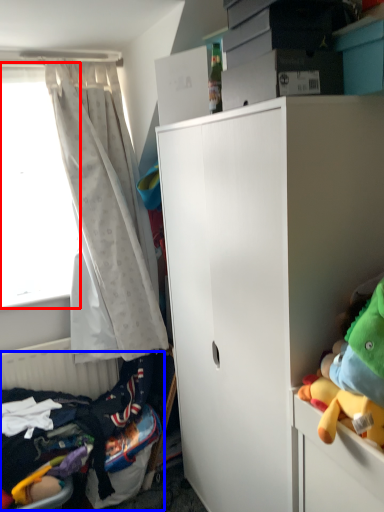
Question: Which point is closer to the camera, window screen (highlighted by a red box) or bed (highlighted by a blue box)?

Choices:
 (A) window screen
 (B) bed

Answer: (B)